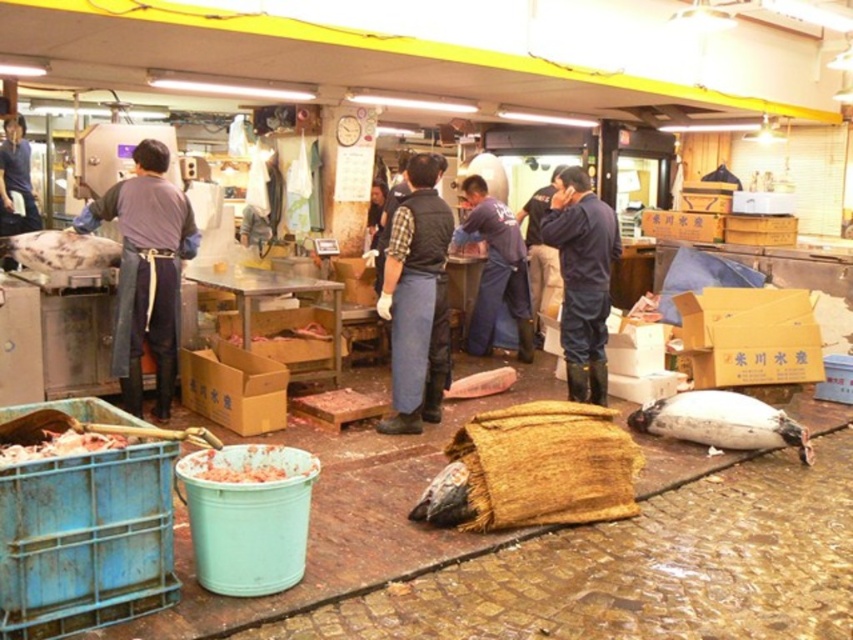
Does dark blue uniform at center lie behind dark blue fabric at center?

No, it is not.

Can you confirm if dark blue uniform at center is thinner than dark blue fabric at center?

Incorrect, dark blue uniform at center's width is not less than dark blue fabric at center's.

What do you see at coordinates (495, 269) in the screenshot? The image size is (853, 640). I see `dark blue uniform at center` at bounding box center [495, 269].

In order to click on dark blue uniform at center in this screenshot , I will do `click(495, 269)`.

Does point (45, 232) lie in front of point (529, 259)?

Yes, point (45, 232) is closer to viewer.

Between point (103, 250) and point (541, 296), which one is positioned in front?

Positioned in front is point (103, 250).

Identify the location of white textured fish at center. (61, 250).

Is dark blue apron at left taller than denim apron at center?

Indeed, dark blue apron at left has a greater height compared to denim apron at center.

This screenshot has width=853, height=640. What are the coordinates of `dark blue apron at left` in the screenshot? It's located at (146, 272).